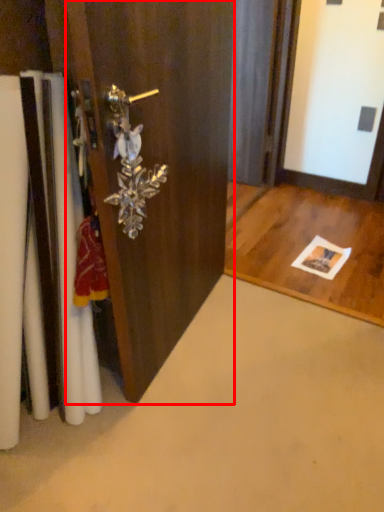
Question: From the image's perspective, what is the correct spatial relationship of door (annotated by the red box) in relation to door handle?

Choices:
 (A) above
 (B) below

Answer: (A)